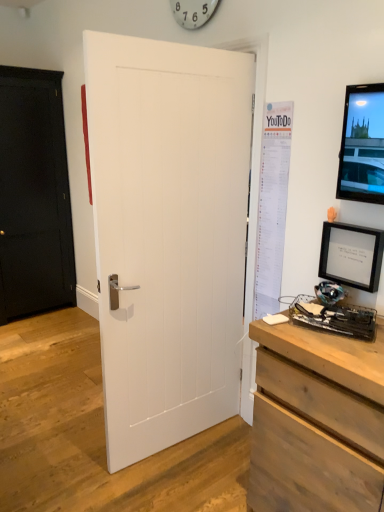
I want to click on black matte picture frame at right, so click(351, 255).

What do you see at coordinates (193, 12) in the screenshot?
I see `white plastic clock at upper center` at bounding box center [193, 12].

In order to face black matte door at left, acting as the second door starting from the front, should I rotate leftwards or rightwards?

You should rotate left by 22.396 degrees.

Locate an element on the screen. metallic black desktop computer at lower right is located at coordinates tap(351, 256).

Find the location of a particular element. white paper poster at right is located at coordinates click(272, 206).

Describe the element at coordinates (317, 421) in the screenshot. The height and width of the screenshot is (512, 384). I see `wooden chest of drawers at lower right` at that location.

Identify the location of black matte picture frame at right. (351, 255).

Is point (364, 230) positioned behind point (264, 224)?

No, it is not.

Considering the positions of objects metallic black desktop computer at lower right and white paper poster at right in the image provided, who is in front, metallic black desktop computer at lower right or white paper poster at right?

metallic black desktop computer at lower right is more forward.

Based on the photo, from the image's perspective, relative to white paper poster at right, is metallic black desktop computer at lower right above or below?

metallic black desktop computer at lower right is below white paper poster at right.

Which of these two, metallic black desktop computer at lower right or white paper poster at right, is thinner?

white paper poster at right is thinner.

Looking at this image, from the image's perspective, would you say white matte notepad at center is positioned over metallic black desktop computer at lower right?

No.

Is white matte notepad at center positioned in front of metallic black desktop computer at lower right?

No, white matte notepad at center is further to the viewer.

What's the angular difference between white matte notepad at center and metallic black desktop computer at lower right's facing directions?

108 degrees separate the facing orientations of white matte notepad at center and metallic black desktop computer at lower right.

Does white matte notepad at center have a lesser width compared to metallic black desktop computer at lower right?

Correct, the width of white matte notepad at center is less than that of metallic black desktop computer at lower right.

Does white paper poster at right have a lesser width compared to black matte picture frame at right?

Indeed, white paper poster at right has a lesser width compared to black matte picture frame at right.

Which is behind, point (277, 247) or point (347, 270)?

The point (277, 247) is farther.

Is white paper poster at right to the right of black matte picture frame at right from the viewer's perspective?

Incorrect, white paper poster at right is not on the right side of black matte picture frame at right.

From the image's perspective, is white paper poster at right located above black matte picture frame at right?

Yes.

How far apart are white matte notepad at center and black matte door at left, the first door when ordered from back to front?

8.58 feet.

From the image's perspective, is white matte notepad at center below black matte door at left, the first door when ordered from back to front?

Correct, white matte notepad at center appears lower than black matte door at left, the first door when ordered from back to front, in the image.

Which is in front, white matte notepad at center or black matte door at left, the 1th door in the left-to-right sequence?

Positioned in front is white matte notepad at center.

Visually, is white matte notepad at center positioned to the left or to the right of black matte door at left, acting as the second door starting from the front?

From the image, it's evident that white matte notepad at center is to the right of black matte door at left, acting as the second door starting from the front.

What's the angular difference between black matte door at left, acting as the second door starting from the front, and white paper poster at right's facing directions?

The facing directions of black matte door at left, acting as the second door starting from the front, and white paper poster at right are 90.7 degrees apart.

Does black matte door at left, the second door viewed from the right, have a lesser height compared to white paper poster at right?

No, black matte door at left, the second door viewed from the right, is not shorter than white paper poster at right.

Which is further, (2,215) or (269,242)?

Positioned behind is point (2,215).

Which of these two, white matte door at center, the 1th door in the front-to-back sequence, or white matte notepad at center, is wider?

Wider between the two is white matte door at center, the 1th door in the front-to-back sequence.

From the picture: From the image's perspective, is white matte door at center, the 1th door in the front-to-back sequence, above or below white matte notepad at center?

white matte door at center, the 1th door in the front-to-back sequence, is above white matte notepad at center.

Is white matte door at center, the second door from the left, in contact with white matte notepad at center?

No, white matte door at center, the second door from the left, is not with white matte notepad at center.

Considering the relative sizes of white matte door at center, the 1th door in the front-to-back sequence, and white matte notepad at center in the image provided, is white matte door at center, the 1th door in the front-to-back sequence, bigger than white matte notepad at center?

Indeed, white matte door at center, the 1th door in the front-to-back sequence, has a larger size compared to white matte notepad at center.

Considering the sizes of black matte door at left, the second door viewed from the right, and white plastic clock at upper center in the image, is black matte door at left, the second door viewed from the right, wider or thinner than white plastic clock at upper center?

In the image, black matte door at left, the second door viewed from the right, appears to be wider than white plastic clock at upper center.

In the scene shown: Is black matte door at left, the 1th door in the left-to-right sequence, situated inside white plastic clock at upper center or outside?

black matte door at left, the 1th door in the left-to-right sequence, lies outside white plastic clock at upper center.

From the picture: Is black matte door at left, the first door when ordered from back to front, bigger or smaller than white plastic clock at upper center?

Considering their sizes, black matte door at left, the first door when ordered from back to front, takes up more space than white plastic clock at upper center.

Is black matte door at left, the second door viewed from the right, looking in the opposite direction of white plastic clock at upper center?

That's not correct — black matte door at left, the second door viewed from the right, is not looking away from white plastic clock at upper center.

Where is `poster page above the metallic black desktop computer at lower right (from a real-world perspective)`? poster page above the metallic black desktop computer at lower right (from a real-world perspective) is located at coordinates (272, 206).

Identify the location of desktop computer on the right of white matte notepad at center. The width and height of the screenshot is (384, 512). (351, 256).

Estimate the real-world distances between objects in this image. Which object is closer to white matte notepad at center, black matte door at left, acting as the second door starting from the front, or white matte door at center, the second door in the back-to-front sequence?

white matte door at center, the second door in the back-to-front sequence, is closer to white matte notepad at center.

Based on their spatial positions, is white matte notepad at center or wooden chest of drawers at lower right closer to black matte picture frame at right?

white matte notepad at center is positioned closer to the anchor black matte picture frame at right.

Looking at this image, from the image, which object appears to be farther from white matte notepad at center, metallic black desktop computer at lower right or black matte door at left, acting as the second door starting from the front?

The object further to white matte notepad at center is black matte door at left, acting as the second door starting from the front.

From the image, which object appears to be farther from black matte picture frame at right, wooden chest of drawers at lower right or black matte door at left, the first door when ordered from back to front?

Among the two, black matte door at left, the first door when ordered from back to front, is located further to black matte picture frame at right.

From the image, which object appears to be farther from black matte picture frame at right, black matte door at left, the first door when ordered from back to front, or white matte door at center, the second door in the back-to-front sequence?

black matte door at left, the first door when ordered from back to front.

Considering their positions, is black matte door at left, the second door viewed from the right, positioned further to white matte notepad at center than white plastic clock at upper center?

black matte door at left, the second door viewed from the right, is further to white matte notepad at center.

Based on their spatial positions, is metallic black desktop computer at lower right or white plastic clock at upper center closer to white matte door at center, the second door from the left?

metallic black desktop computer at lower right is closer to white matte door at center, the second door from the left.

Based on their spatial positions, is white matte door at center, the second door from the left, or white matte notepad at center closer to wooden chest of drawers at lower right?

white matte notepad at center is closer to wooden chest of drawers at lower right.

Identify the location of poster page between white plastic clock at upper center and wooden chest of drawers at lower right from top to bottom. This screenshot has width=384, height=512. (272, 206).

Identify the location of clock located between black matte door at left, the second door viewed from the right, and wooden chest of drawers at lower right in the left-right direction. Image resolution: width=384 pixels, height=512 pixels. (193, 12).

Where is `desktop computer that lies between white plastic clock at upper center and white matte notepad at center from top to bottom`? The image size is (384, 512). desktop computer that lies between white plastic clock at upper center and white matte notepad at center from top to bottom is located at coordinates (351, 256).

Identify the location of picture frame between white plastic clock at upper center and white matte notepad at center in the vertical direction. The width and height of the screenshot is (384, 512). (351, 255).